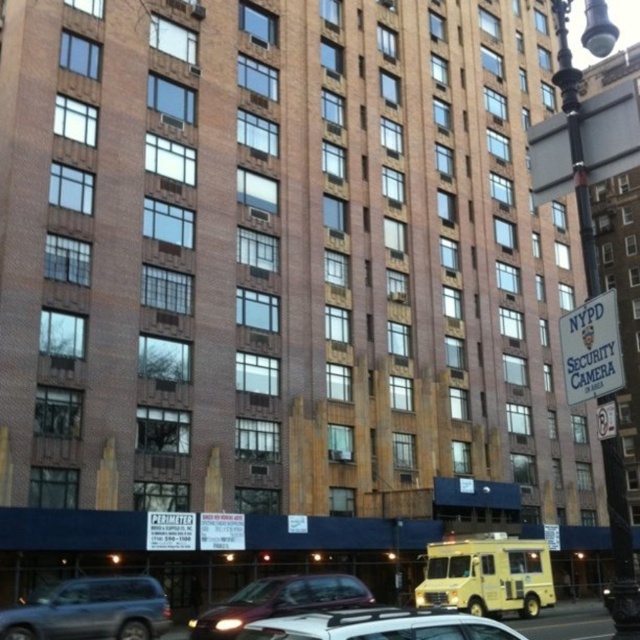
You are standing in front of the building and want to determine the relative positions of two points marked on the facade. Which point is closer to you, point [524,609] or point [600,368]?

Point [524,609] is further to the viewer than point [600,368], so the closer point to you is point [600,368].